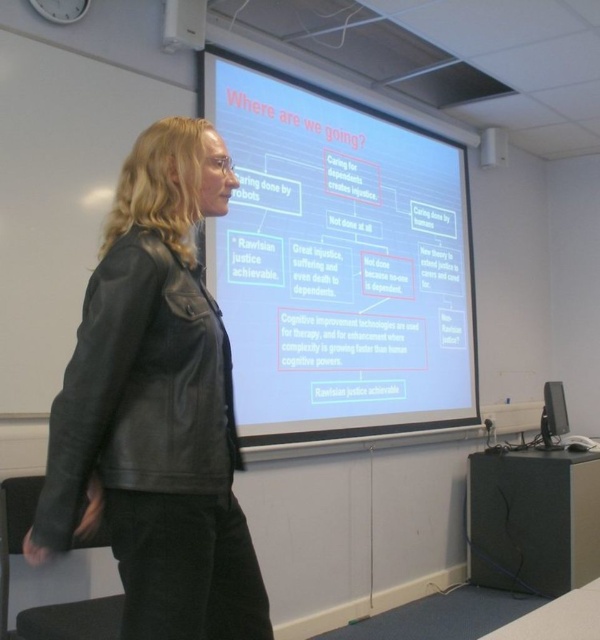
Consider the image. Which of these two, white matte projection screen at upper center or black leather jacket at left, stands shorter?

With less height is black leather jacket at left.

Between point (318, 365) and point (211, 458), which one is positioned behind?

The point (318, 365) is behind.

At what (x,y) coordinates should I click in order to perform the action: click on white matte projection screen at upper center. Please return your answer as a coordinate pair (x, y). The height and width of the screenshot is (640, 600). Looking at the image, I should click on (338, 262).

Can you confirm if black leather jacket at left is shorter than whiteboard at upper left?

Yes.

Who is more forward, (196,605) or (96,241)?

Point (196,605) is in front.

The image size is (600, 640). Identify the location of black leather jacket at left. (157, 406).

Which is above, white matte projection screen at upper center or whiteboard at upper left?

whiteboard at upper left is above.

Identify the location of white matte projection screen at upper center. The height and width of the screenshot is (640, 600). (338, 262).

Where is `white matte projection screen at upper center`? Image resolution: width=600 pixels, height=640 pixels. white matte projection screen at upper center is located at coordinates (338, 262).